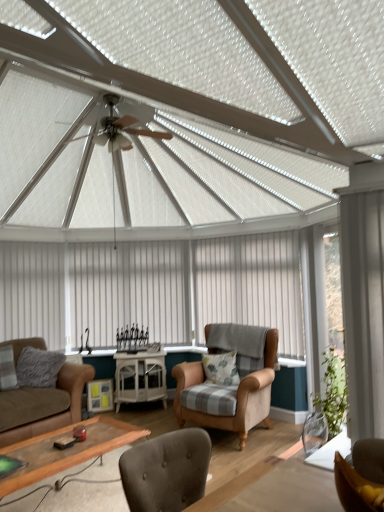
Find the location of a particular element. This screenshot has height=512, width=384. vacant space situated above white fabric curtain at center, the second curtain when ordered from front to back (from a real-world perspective) is located at coordinates (241, 230).